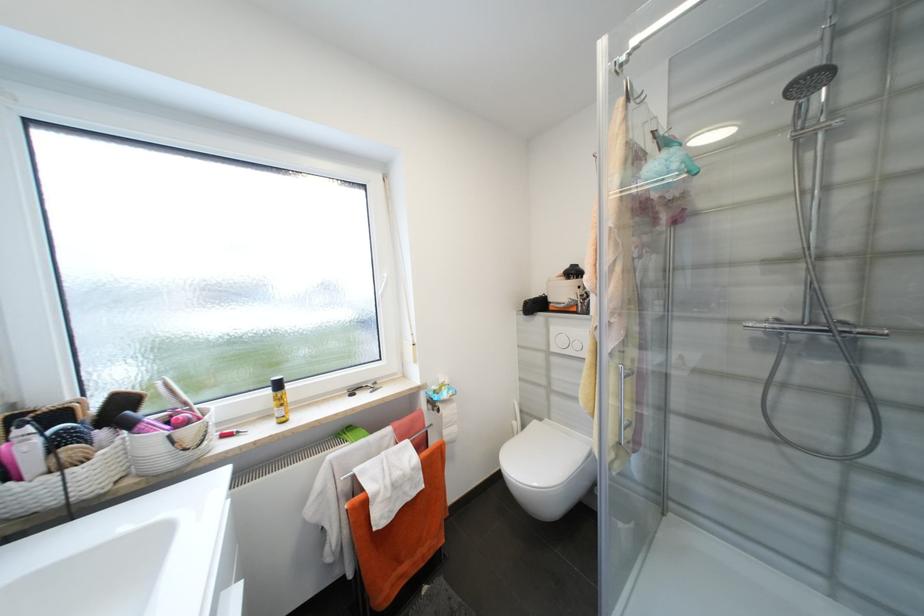
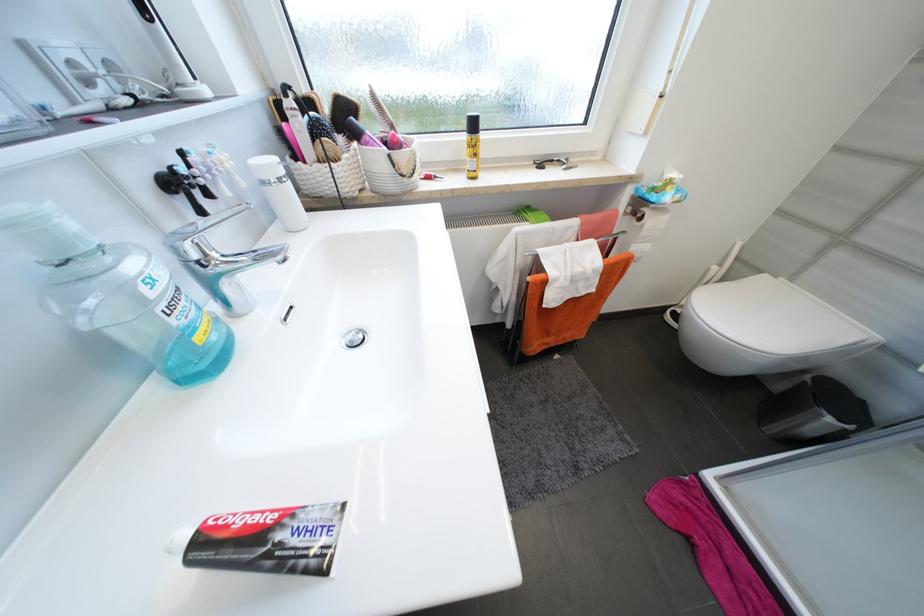
Where in the second image is the point corresponding to the point at 444,411 from the first image?

(647, 219)